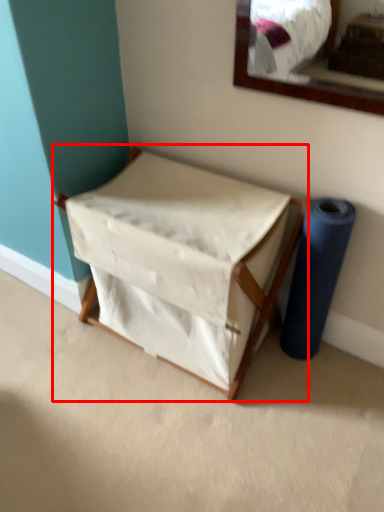
Question: From the image's perspective, what is the correct spatial positioning of furniture (annotated by the red box) in reference to duct tape?

Choices:
 (A) below
 (B) above

Answer: (B)